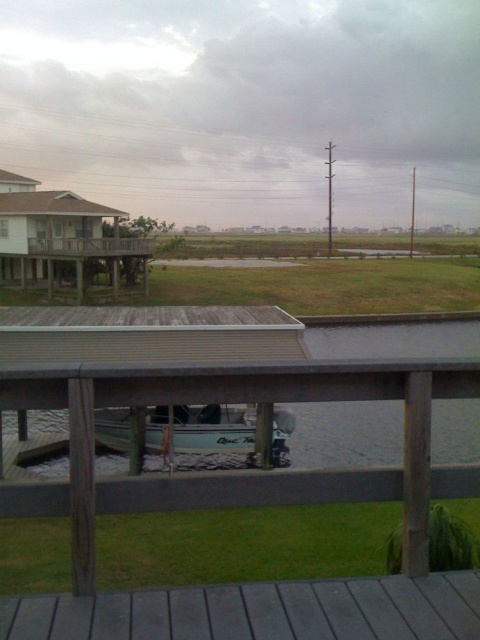
Does dark gray wood deck at lower center appear under light blue fiberglass boat at center?

No, dark gray wood deck at lower center is not below light blue fiberglass boat at center.

Between point (291, 604) and point (187, 417), which one is positioned behind?

Point (187, 417)

Identify the location of dark gray wood deck at lower center. The image size is (480, 640). (260, 611).